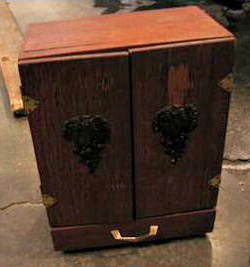
At what (x,y) coordinates should I click in order to perform the action: click on handles. Please return your answer as a coordinate pair (x, y). Looking at the image, I should click on (133, 240), (173, 131), (87, 148).